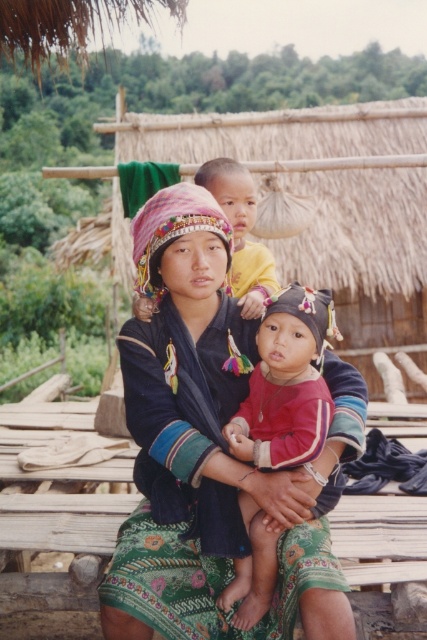
Between embroidered fabric dress at center and matte yellow shirt at center, which one appears on the left side from the viewer's perspective?

Positioned to the left is embroidered fabric dress at center.

Consider the image. Can you confirm if embroidered fabric dress at center is smaller than matte yellow shirt at center?

Incorrect, embroidered fabric dress at center is not smaller in size than matte yellow shirt at center.

In order to click on embroidered fabric dress at center in this screenshot , I will do `click(201, 451)`.

Where is `embroidered fabric dress at center`? embroidered fabric dress at center is located at coordinates tap(201, 451).

Where is `embroidered fabric dress at center`? This screenshot has width=427, height=640. embroidered fabric dress at center is located at coordinates (201, 451).

This screenshot has width=427, height=640. What do you see at coordinates (201, 451) in the screenshot?
I see `embroidered fabric dress at center` at bounding box center [201, 451].

You are a GUI agent. You are given a task and a screenshot of the screen. Output one action in this format:
    pyautogui.click(x=<x>, y=<y>)
    Task: Click on the embroidered fabric dress at center
    This screenshot has width=427, height=640.
    Given the screenshot: What is the action you would take?
    pyautogui.click(x=201, y=451)

Identify the location of matte red shirt at center. (286, 385).

From the picture: Who is positioned more to the right, matte red shirt at center or matte yellow shirt at center?

matte red shirt at center

What do you see at coordinates (286, 385) in the screenshot?
I see `matte red shirt at center` at bounding box center [286, 385].

You are a GUI agent. You are given a task and a screenshot of the screen. Output one action in this format:
    pyautogui.click(x=<x>, y=<y>)
    Task: Click on the matte red shirt at center
    This screenshot has height=640, width=427.
    Given the screenshot: What is the action you would take?
    (286, 385)